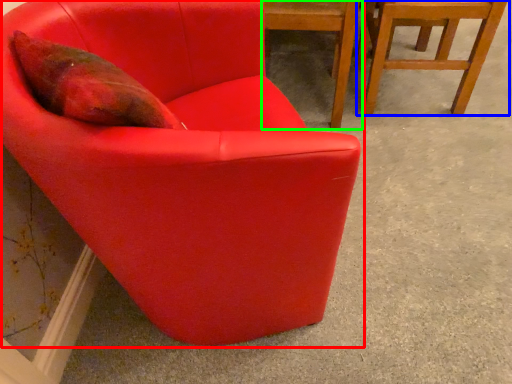
Question: Based on their relative distances, which object is nearer to chair (highlighted by a red box)? Choose from chair (highlighted by a blue box) and chair (highlighted by a green box).

Choices:
 (A) chair
 (B) chair

Answer: (B)